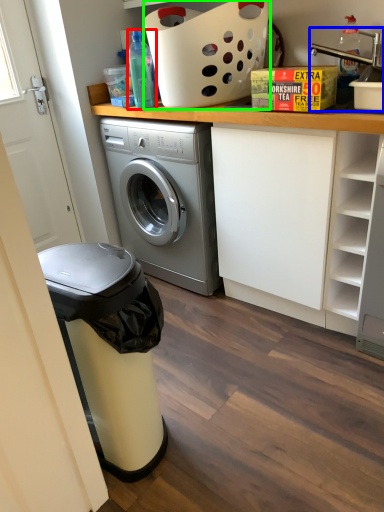
Question: Which object is the farthest from bottle (highlighted by a red box)? Choose among these: sink (highlighted by a blue box) or basket (highlighted by a green box).

Choices:
 (A) sink
 (B) basket

Answer: (A)